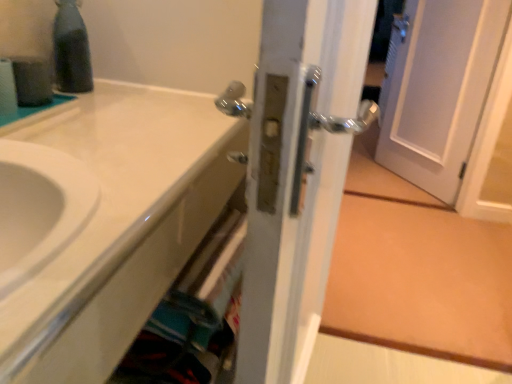
Identify the location of white glossy sink at lower left. This screenshot has width=512, height=384. (120, 227).

This screenshot has height=384, width=512. Describe the element at coordinates (71, 50) in the screenshot. I see `black glass bottle at upper left` at that location.

Locate an element on the screen. Image resolution: width=512 pixels, height=384 pixels. white glossy sink at lower left is located at coordinates (120, 227).

Is satin nickel door handle at center far from white glossy sink at lower left?

No, there isn't a large distance between satin nickel door handle at center and white glossy sink at lower left.

Considering the positions of points (284, 168) and (77, 148), is point (284, 168) closer to camera compared to point (77, 148)?

Yes, it is.

Considering the sizes of objects satin nickel door handle at center and white glossy sink at lower left in the image provided, who is shorter, satin nickel door handle at center or white glossy sink at lower left?

With less height is white glossy sink at lower left.

Considering the relative sizes of satin nickel door handle at center and white glossy sink at lower left in the image provided, is satin nickel door handle at center wider than white glossy sink at lower left?

No, satin nickel door handle at center is not wider than white glossy sink at lower left.

Is black glass bottle at upper left looking in the opposite direction of satin nickel door handle at center?

No, black glass bottle at upper left's orientation is not away from satin nickel door handle at center.

From the image's perspective, who appears lower, black glass bottle at upper left or satin nickel door handle at center?

satin nickel door handle at center.

Is black glass bottle at upper left outside of satin nickel door handle at center?

Yes, black glass bottle at upper left is not within satin nickel door handle at center.

Is black glass bottle at upper left in contact with satin nickel door handle at center?

black glass bottle at upper left and satin nickel door handle at center are not in contact.

Identify the location of bathroom cabinet behind the satin nickel door handle at center. (120, 227).

In the image, is white glossy sink at lower left positioned in front of or behind satin nickel door handle at center?

In the image, white glossy sink at lower left appears behind satin nickel door handle at center.

Would you say white glossy sink at lower left is inside or outside satin nickel door handle at center?

white glossy sink at lower left is spatially situated outside satin nickel door handle at center.

Looking at this image, which of these two, satin nickel door handle at center or black glass bottle at upper left, is wider?

satin nickel door handle at center is wider.

From the picture: Who is more distant, satin nickel door handle at center or black glass bottle at upper left?

black glass bottle at upper left.

Is satin nickel door handle at center in contact with black glass bottle at upper left?

satin nickel door handle at center is not next to black glass bottle at upper left, and they're not touching.

Find the location of `bottle above the white glossy sink at lower left (from the image's perspective)`. bottle above the white glossy sink at lower left (from the image's perspective) is located at coordinates (71, 50).

Is black glass bottle at upper left looking in the opposite direction of white glossy sink at lower left?

No.

Does black glass bottle at upper left have a greater height compared to white glossy sink at lower left?

Correct, black glass bottle at upper left is much taller as white glossy sink at lower left.

Could you tell me if white glossy sink at lower left is facing black glass bottle at upper left?

No, white glossy sink at lower left does not turn towards black glass bottle at upper left.

Does point (182, 170) come closer to viewer compared to point (68, 48)?

Yes, point (182, 170) is closer to viewer.

Between white glossy sink at lower left and black glass bottle at upper left, which one appears on the right side from the viewer's perspective?

From the viewer's perspective, white glossy sink at lower left appears more on the right side.

Is the depth of white glossy sink at lower left greater than that of black glass bottle at upper left?

No, white glossy sink at lower left is closer to the camera.

Where is `door below the white glossy sink at lower left (from the image's perspective)`? door below the white glossy sink at lower left (from the image's perspective) is located at coordinates (296, 173).

Find the location of a particular element. bottle above the satin nickel door handle at center (from a real-world perspective) is located at coordinates (71, 50).

When comparing their distances from white glossy sink at lower left, does satin nickel door handle at center or black glass bottle at upper left seem further?

black glass bottle at upper left is positioned further to the anchor white glossy sink at lower left.

Considering their positions, is satin nickel door handle at center positioned further to black glass bottle at upper left than white glossy sink at lower left?

satin nickel door handle at center.

Looking at the image, which one is located closer to satin nickel door handle at center, black glass bottle at upper left or white glossy sink at lower left?

white glossy sink at lower left lies closer to satin nickel door handle at center than the other object.

Looking at the image, which one is located closer to satin nickel door handle at center, white glossy sink at lower left or black glass bottle at upper left?

white glossy sink at lower left lies closer to satin nickel door handle at center than the other object.

Estimate the real-world distances between objects in this image. Which object is further from black glass bottle at upper left, white glossy sink at lower left or satin nickel door handle at center?

satin nickel door handle at center is further to black glass bottle at upper left.

From the image, which object appears to be farther from white glossy sink at lower left, black glass bottle at upper left or satin nickel door handle at center?

black glass bottle at upper left is further to white glossy sink at lower left.

This screenshot has width=512, height=384. Find the location of `bathroom cabinet between satin nickel door handle at center and black glass bottle at upper left in the front-back direction`. bathroom cabinet between satin nickel door handle at center and black glass bottle at upper left in the front-back direction is located at coordinates (120, 227).